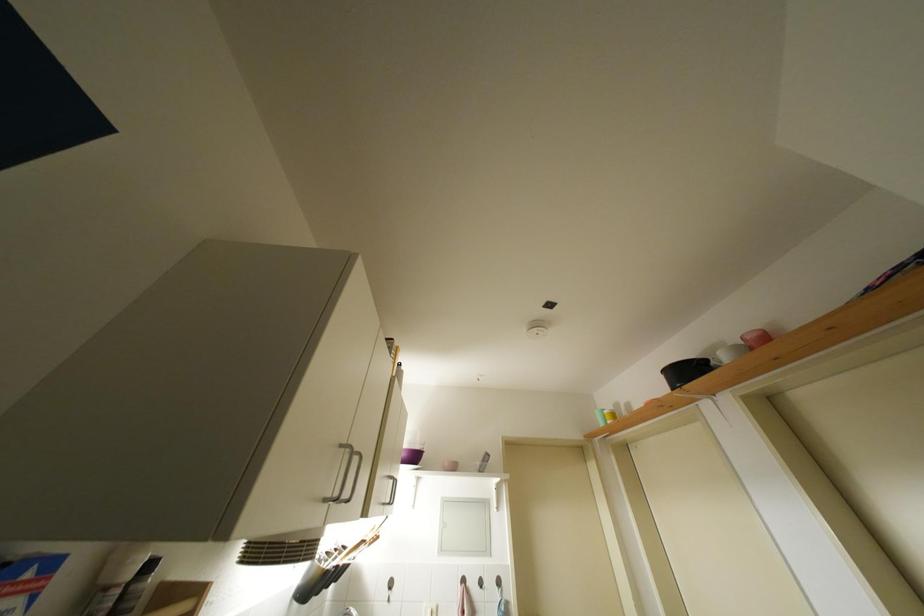
Identify the location of green cup. (604, 416).